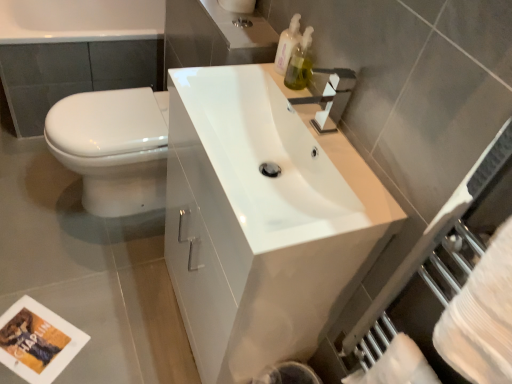
Where is `space that is in front of matte silver faucet at upper center`? The height and width of the screenshot is (384, 512). space that is in front of matte silver faucet at upper center is located at coordinates (238, 33).